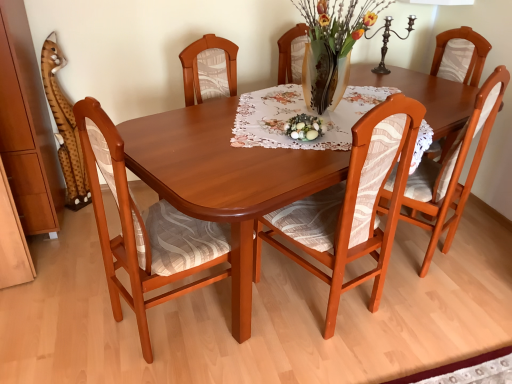
Question: Is matte wood chair at center, the 2th chair from the right, not close to shiny wood table at center?

Choices:
 (A) yes
 (B) no

Answer: (B)

Question: From a real-world perspective, is matte wood chair at center, positioned as the 2th chair in left-to-right order, on shiny wood table at center?

Choices:
 (A) no
 (B) yes

Answer: (B)

Question: From a real-world perspective, does matte wood chair at center, the 2th chair from the right, sit lower than shiny wood table at center?

Choices:
 (A) yes
 (B) no

Answer: (B)

Question: Is matte wood chair at center, positioned as the 2th chair in left-to-right order, turned away from shiny wood table at center?

Choices:
 (A) yes
 (B) no

Answer: (B)

Question: Considering the relative sizes of matte wood chair at center, positioned as the 2th chair in left-to-right order, and shiny wood table at center in the image provided, is matte wood chair at center, positioned as the 2th chair in left-to-right order, shorter than shiny wood table at center?

Choices:
 (A) no
 (B) yes

Answer: (A)

Question: Is shiny wood table at center completely or partially inside matte wood chair at center, positioned as the 2th chair in left-to-right order?

Choices:
 (A) no
 (B) yes

Answer: (A)

Question: Considering the relative positions of shiny wood table at center and wooden chair at left, marked as the first chair in a left-to-right arrangement, in the image provided, is shiny wood table at center to the left of wooden chair at left, marked as the first chair in a left-to-right arrangement, from the viewer's perspective?

Choices:
 (A) no
 (B) yes

Answer: (A)

Question: Is shiny wood table at center facing towards wooden chair at left, which is the 3th chair from right to left?

Choices:
 (A) yes
 (B) no

Answer: (B)

Question: From the image's perspective, is shiny wood table at center located beneath wooden chair at left, marked as the first chair in a left-to-right arrangement?

Choices:
 (A) no
 (B) yes

Answer: (B)

Question: Is shiny wood table at center further to camera compared to wooden chair at left, marked as the first chair in a left-to-right arrangement?

Choices:
 (A) no
 (B) yes

Answer: (A)

Question: From the image's perspective, is shiny wood table at center above wooden chair at left, which is the 3th chair from right to left?

Choices:
 (A) no
 (B) yes

Answer: (A)

Question: Considering the relative sizes of shiny wood table at center and wooden chair at left, which is the 3th chair from right to left, in the image provided, is shiny wood table at center shorter than wooden chair at left, which is the 3th chair from right to left,?

Choices:
 (A) yes
 (B) no

Answer: (A)

Question: Is matte green glass bowl at center oriented towards matte wood chair at center, positioned as the 2th chair in left-to-right order?

Choices:
 (A) yes
 (B) no

Answer: (A)